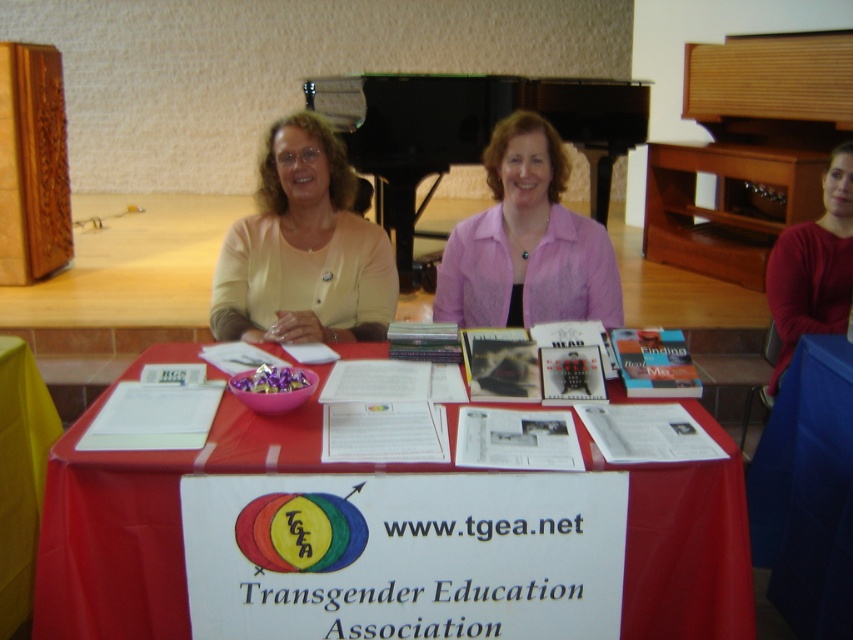
Question: Considering the real-world distances, which object is farthest from the pink sheer blouse at center?

Choices:
 (A) red matte shirt at upper right
 (B) matte yellow sweater at center
 (C) red cloth at center
 (D) yellow fabric at lower left

Answer: (D)

Question: Among these points, which one is nearest to the camera?

Choices:
 (A) (6, 451)
 (B) (549, 182)
 (C) (300, 118)
 (D) (164, 545)

Answer: (D)

Question: Can you confirm if red cloth at center is thinner than yellow fabric at lower left?

Choices:
 (A) no
 (B) yes

Answer: (A)

Question: Is pink sheer blouse at center behind yellow fabric at lower left?

Choices:
 (A) yes
 (B) no

Answer: (A)

Question: Which of the following is the farthest from the observer?

Choices:
 (A) red matte shirt at upper right
 (B) pink sheer blouse at center
 (C) yellow fabric at lower left
 (D) red cloth at center

Answer: (A)

Question: Does red cloth at center appear on the right side of red matte shirt at upper right?

Choices:
 (A) yes
 (B) no

Answer: (B)